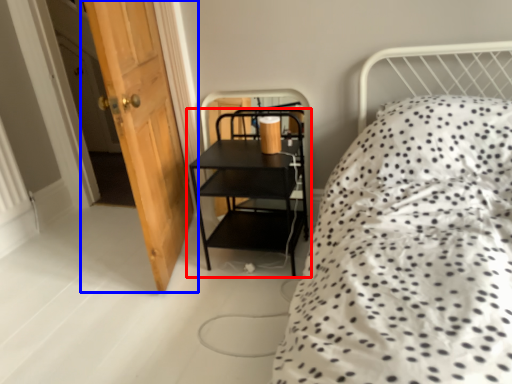
Question: Which object is further to the camera taking this photo, shelf (highlighted by a red box) or door (highlighted by a blue box)?

Choices:
 (A) shelf
 (B) door

Answer: (A)